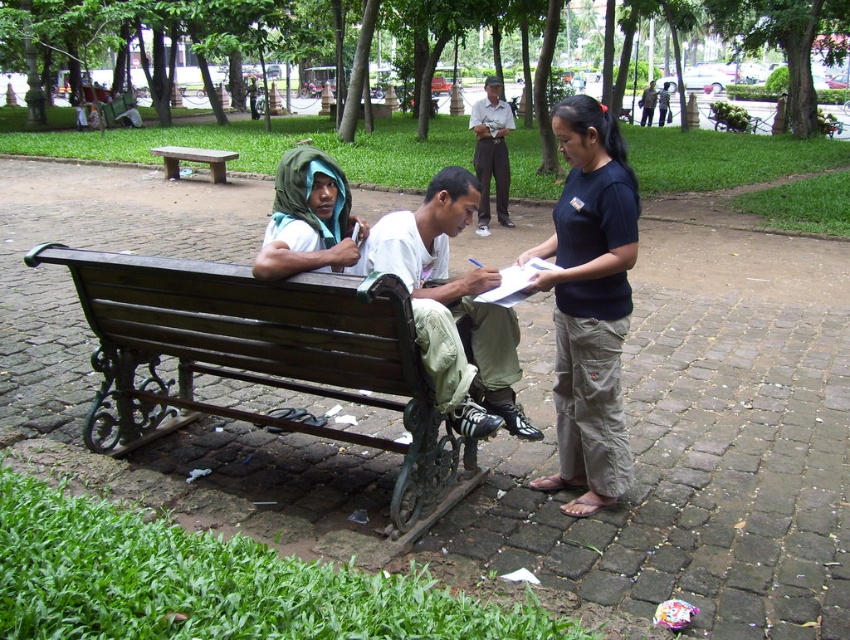
Question: Can you confirm if dark brown wood bench at lower center is positioned below white t-shirt at center?

Choices:
 (A) yes
 (B) no

Answer: (A)

Question: Which point is farther to the camera?

Choices:
 (A) coord(58,257)
 (B) coord(445,278)
 (C) coord(301,182)

Answer: (B)

Question: Which object is farther from the camera taking this photo?

Choices:
 (A) dark brown wood bench at lower center
 (B) brown wooden bench at center

Answer: (B)

Question: Which is nearer to the dark brown wood bench at lower center?

Choices:
 (A) white t-shirt at center
 (B) light gray uniform at center
 (C) matte green headscarf at center
 (D) dark blue cotton shirt at center

Answer: (A)

Question: Is the position of dark blue cotton shirt at center less distant than that of brown wooden bench at center?

Choices:
 (A) no
 (B) yes

Answer: (B)

Question: Is dark blue cotton shirt at center positioned at the back of white t-shirt at center?

Choices:
 (A) no
 (B) yes

Answer: (B)